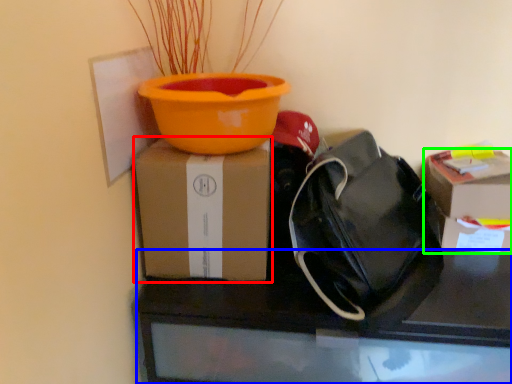
Question: Which object is the farthest from box (highlighted by a red box)? Choose among these: desk (highlighted by a blue box) or box (highlighted by a green box).

Choices:
 (A) desk
 (B) box

Answer: (B)